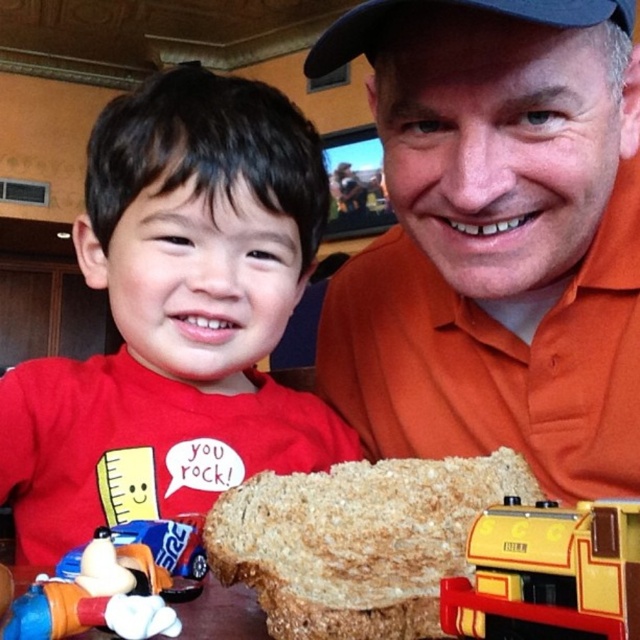
Looking at this image, you are standing in front of the dining table and want to place a small decoration between the two points, point (225, 358) and point (545, 557). Which point should you place it closer to in order to make it appear closer to the camera?

You should place the decoration closer to point (225, 358) because it is already further to the camera than point (545, 557). This will ensure the decoration appears closer to the camera.

You are a photographer trying to capture a clear photo of the matte red shirt at left and the yellow matte train at lower center. Which object will appear bigger in your photo?

The matte red shirt at left will appear bigger in the photo because it has a larger size compared to the yellow matte train at lower center.

You are a tailor measuring the orange cotton shirt at center and the brown textured bread at center for a custom fitting. Which item has a greater width?

The orange cotton shirt at center has a greater width than the brown textured bread at center according to the description.